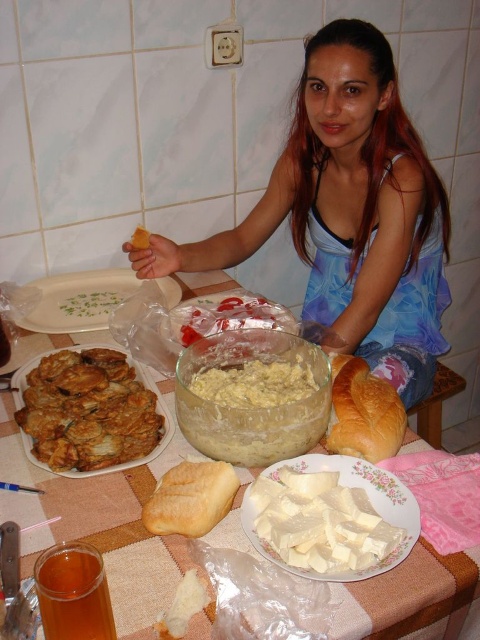
Is white creamy dip at center thinner than golden crispy fried at left?

Correct, white creamy dip at center's width is less than golden crispy fried at left's.

Does point (239, 360) come in front of point (84, 392)?

No, it is not.

Does point (207, 401) come in front of point (82, 394)?

Yes, it is in front of point (82, 394).

This screenshot has height=640, width=480. What are the coordinates of `white creamy dip at center` in the screenshot? It's located at (252, 396).

Is the position of white glossy plate at upper left more distant than that of white glossy platter at center?

No, white glossy plate at upper left is closer to the viewer.

The image size is (480, 640). What do you see at coordinates (99, 522) in the screenshot?
I see `white glossy plate at upper left` at bounding box center [99, 522].

Locate an element on the screen. white glossy plate at upper left is located at coordinates (99, 522).

Between white matte cheese at center and white glossy platter at center, which one appears on the right side from the viewer's perspective?

From the viewer's perspective, white matte cheese at center appears more on the right side.

Which of these two, white matte cheese at center or white glossy platter at center, stands shorter?

white matte cheese at center

I want to click on white matte cheese at center, so click(350, 486).

Image resolution: width=480 pixels, height=640 pixels. Find the location of `white matte cheese at center`. white matte cheese at center is located at coordinates (350, 486).